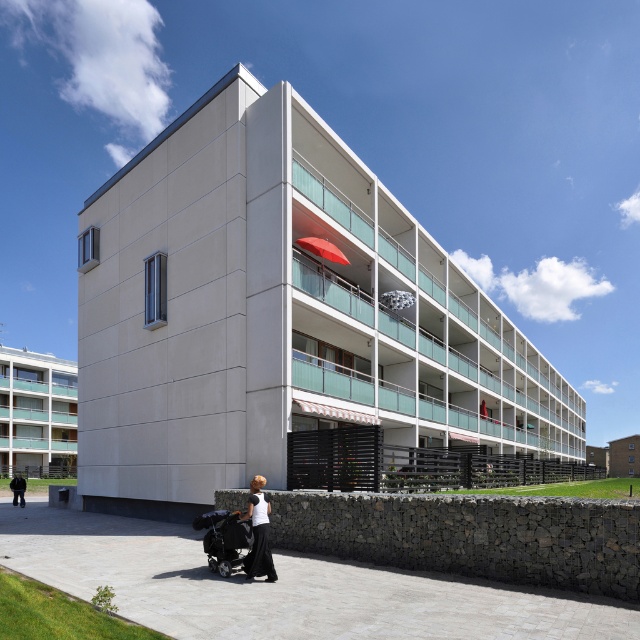
Based on the photo, you are a photographer setting up a tripod in the foreground of the scene. You need to ensure that both the black fabric baby carriage at lower center and the black matte dress at lower center are visible in your shot. Given their heights, which object will appear taller in the photograph?

The black matte dress at lower center will appear taller in the photograph since it is taller than the black fabric baby carriage at lower center.

Looking at this image, you are standing on the paved walkway next to the low stone wall and see the black fabric baby carriage at lower center. Can you estimate how far the baby carriage is from the stone wall based on its coordinates?

The black fabric baby carriage at lower center is located at point (x=224, y=538). Since the coordinates are relative to the image frame, without specific scale information, it is not possible to determine the exact distance from the stone wall.

Looking at this image, you are a fashion designer observing a woman wearing a black matte dress at lower center and a black fabric at lower left. Which item is narrower?

The black matte dress at lower center is narrower than the black fabric at lower left.